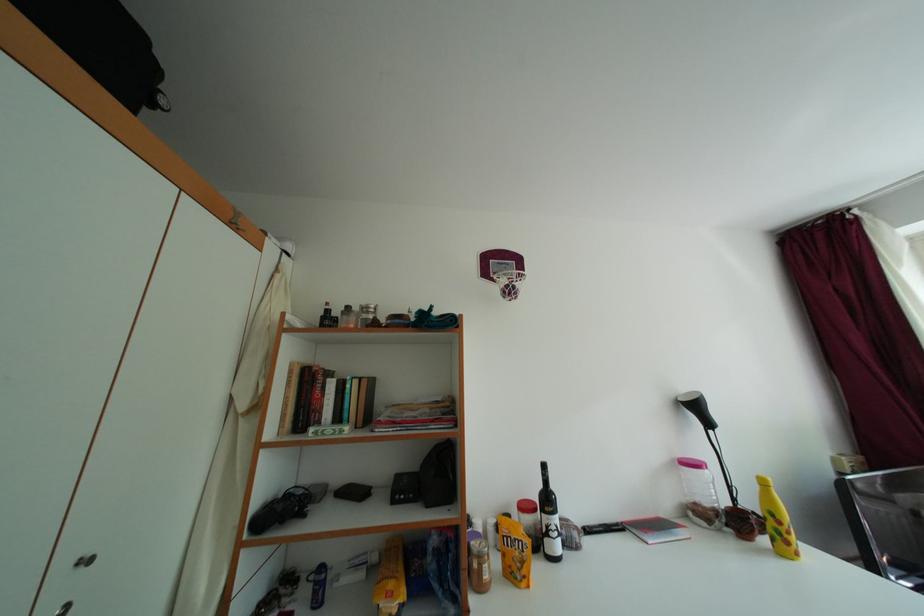
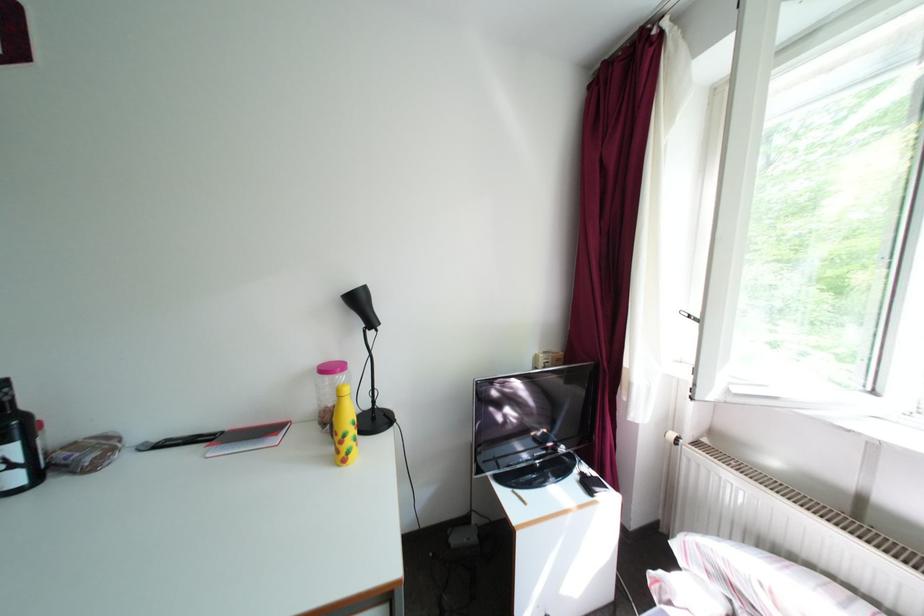
Question: Which direction would the cameraman need to move to produce the second image? Reply with the corresponding letter.

Choices:
 (A) Left
 (B) Right
 (C) Forward
 (D) Backward

Answer: (B)